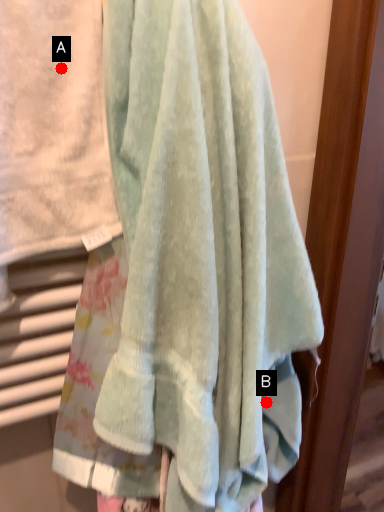
Question: Two points are circled on the image, labeled by A and B beside each circle. Which point is farther to the camera?

Choices:
 (A) A is further
 (B) B is further

Answer: (B)